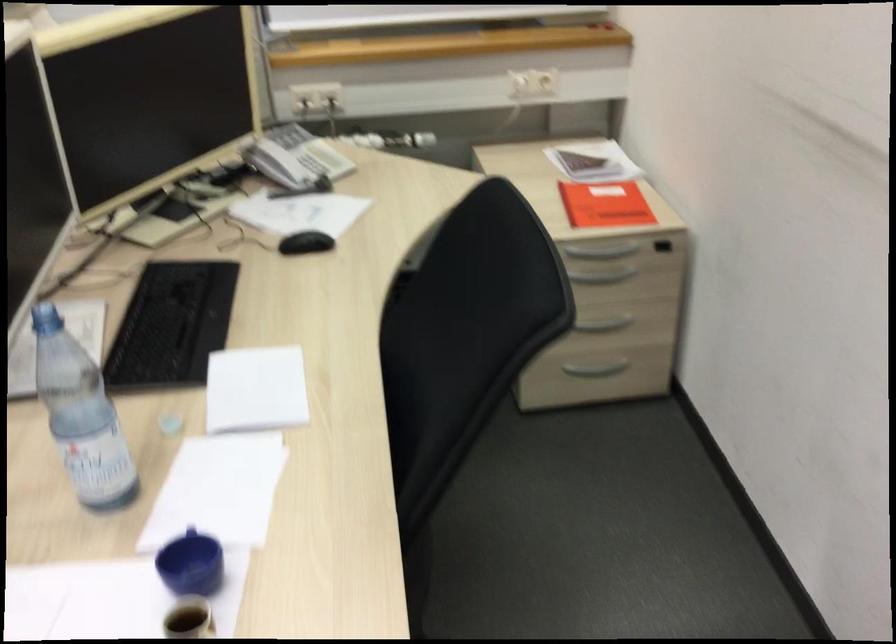
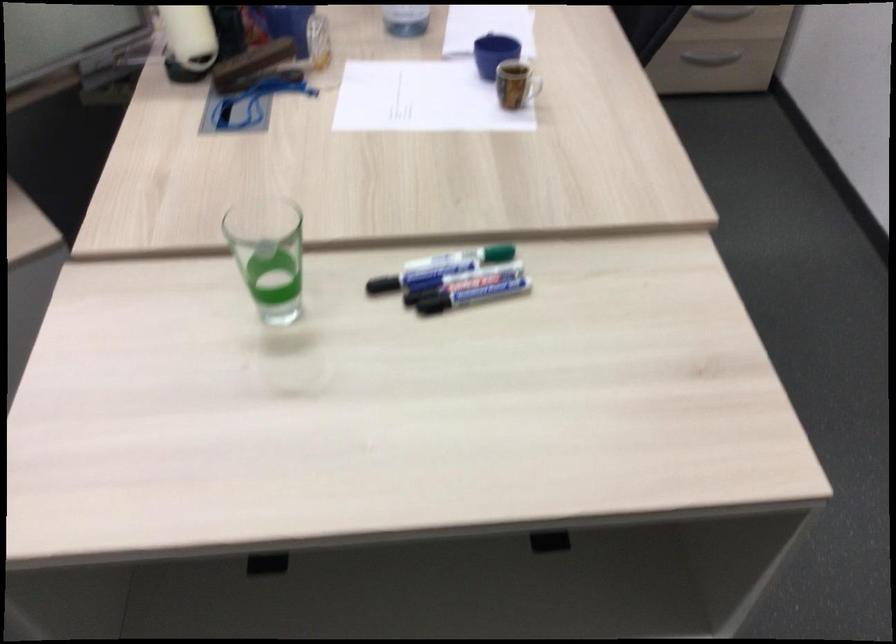
Where in the second image is the point corresponding to [616,332] from the first image?

(734, 22)